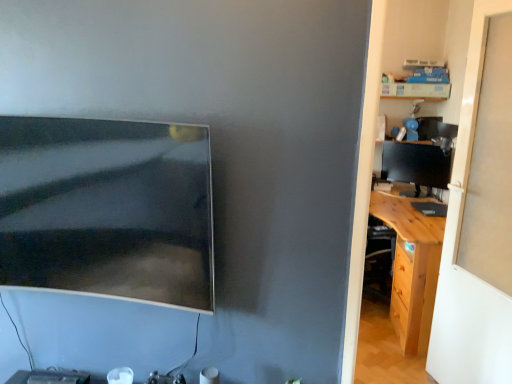
What do you see at coordinates (412, 267) in the screenshot? This screenshot has width=512, height=384. I see `light brown wood desk at right` at bounding box center [412, 267].

This screenshot has width=512, height=384. What do you see at coordinates (106, 209) in the screenshot?
I see `matte black monitor at upper left, the 2th computer monitor positioned from the back` at bounding box center [106, 209].

The width and height of the screenshot is (512, 384). Find the location of `matte black monitor at right, the 1th computer monitor positioned from the right`. matte black monitor at right, the 1th computer monitor positioned from the right is located at coordinates (416, 165).

Is point (418, 182) in front of point (396, 72)?

Yes, it is.

Would you consider matte black monitor at right, marked as the 2th computer monitor in a front-to-back arrangement, to be distant from wooden desk at right?

Actually, matte black monitor at right, marked as the 2th computer monitor in a front-to-back arrangement, and wooden desk at right are a little close together.

Is matte black monitor at right, the 1th computer monitor positioned from the right, behind wooden desk at right?

Yes, it is.

What's the angular difference between matte black monitor at right, placed as the second computer monitor when sorted from left to right, and wooden desk at right's facing directions?

39.1 degrees separate the facing orientations of matte black monitor at right, placed as the second computer monitor when sorted from left to right, and wooden desk at right.

Is wooden desk at right not inside matte black monitor at upper left, acting as the 1th computer monitor starting from the front?

Indeed, wooden desk at right is completely outside matte black monitor at upper left, acting as the 1th computer monitor starting from the front.

Consider the image. Is wooden desk at right oriented towards matte black monitor at upper left, acting as the 1th computer monitor starting from the front?

No, wooden desk at right is not aimed at matte black monitor at upper left, acting as the 1th computer monitor starting from the front.

Looking at this image, does wooden desk at right come in front of matte black monitor at upper left, the 2th computer monitor positioned from the back?

That is True.

Does point (355, 237) come closer to viewer compared to point (89, 253)?

That is True.

Looking at this image, is wooden desk at right located outside light brown wood desk at right?

wooden desk at right lies outside light brown wood desk at right's area.

From a real-world perspective, is wooden desk at right physically above light brown wood desk at right?

Yes, from a real-world perspective, wooden desk at right is on top of light brown wood desk at right.

Is wooden desk at right at the right side of light brown wood desk at right?

No, wooden desk at right is not to the right of light brown wood desk at right.

From the image's perspective, which one is positioned lower, wooden desk at right or light brown wood desk at right?

light brown wood desk at right, from the image's perspective.

Is matte black monitor at right, positioned as the first computer monitor in back-to-front order, inside the boundaries of light brown wood desk at right, or outside?

matte black monitor at right, positioned as the first computer monitor in back-to-front order, is not inside light brown wood desk at right, it's outside.

From a real-world perspective, is matte black monitor at right, placed as the second computer monitor when sorted from left to right, physically located above or below light brown wood desk at right?

Clearly, from a real-world perspective, matte black monitor at right, placed as the second computer monitor when sorted from left to right, is above light brown wood desk at right.

In order to click on desk that is on the left side of matte black monitor at right, positioned as the first computer monitor in back-to-front order in this screenshot , I will do `click(412, 267)`.

Find the location of a particular element. The image size is (512, 384). computer monitor on the right of matte black monitor at upper left, the 2th computer monitor from the right is located at coordinates (416, 165).

Looking at their sizes, would you say matte black monitor at right, positioned as the first computer monitor in back-to-front order, is wider or thinner than matte black monitor at upper left, the 2th computer monitor positioned from the back?

Clearly, matte black monitor at right, positioned as the first computer monitor in back-to-front order, has less width compared to matte black monitor at upper left, the 2th computer monitor positioned from the back.

From the image's perspective, which one is positioned higher, matte black monitor at right, marked as the 2th computer monitor in a front-to-back arrangement, or matte black monitor at upper left, acting as the 1th computer monitor starting from the front?

matte black monitor at right, marked as the 2th computer monitor in a front-to-back arrangement.

Is wooden desk at right touching matte black monitor at right, marked as the 2th computer monitor in a front-to-back arrangement?

wooden desk at right and matte black monitor at right, marked as the 2th computer monitor in a front-to-back arrangement, are not in contact.

Is wooden desk at right looking in the opposite direction of matte black monitor at right, positioned as the first computer monitor in back-to-front order?

Absolutely, wooden desk at right is directed away from matte black monitor at right, positioned as the first computer monitor in back-to-front order.

Would you say wooden desk at right is to the left or to the right of matte black monitor at right, marked as the 2th computer monitor in a front-to-back arrangement, in the picture?

wooden desk at right is to the left of matte black monitor at right, marked as the 2th computer monitor in a front-to-back arrangement.

From the image's perspective, is wooden desk at right located beneath matte black monitor at right, positioned as the first computer monitor in back-to-front order?

Yes, from the image's perspective, wooden desk at right is beneath matte black monitor at right, positioned as the first computer monitor in back-to-front order.

Based on their sizes in the image, would you say light brown wood desk at right is bigger or smaller than wooden desk at right?

Clearly, light brown wood desk at right is larger in size than wooden desk at right.

Based on the photo, is there a large distance between light brown wood desk at right and wooden desk at right?

That's right, there is a large distance between light brown wood desk at right and wooden desk at right.

From a real-world perspective, is light brown wood desk at right over wooden desk at right?

No.

Is light brown wood desk at right facing towards wooden desk at right?

No, light brown wood desk at right is not aimed at wooden desk at right.

I want to click on computer monitor on the right of wooden desk at right, so click(416, 165).

From the wooden desk at right, count 1st computer monitors backward and point to it. Please provide its 2D coordinates.

[(106, 209)]

When comparing their distances from matte black monitor at right, placed as the second computer monitor when sorted from left to right, does light brown wood desk at right or matte black monitor at upper left, the 2th computer monitor positioned from the back, seem further?

Among the two, matte black monitor at upper left, the 2th computer monitor positioned from the back, is located further to matte black monitor at right, placed as the second computer monitor when sorted from left to right.

From the image, which object appears to be nearer to light brown wood desk at right, matte black monitor at upper left, acting as the 1th computer monitor starting from the front, or matte black monitor at right, placed as the second computer monitor when sorted from left to right?

The object closer to light brown wood desk at right is matte black monitor at right, placed as the second computer monitor when sorted from left to right.

Based on their spatial positions, is wooden desk at right or light brown wood desk at right further from matte black monitor at right, placed as the second computer monitor when sorted from left to right?

Based on the image, light brown wood desk at right appears to be further to matte black monitor at right, placed as the second computer monitor when sorted from left to right.

Considering their positions, is matte black monitor at upper left, acting as the 1th computer monitor starting from the front, positioned closer to matte black monitor at right, the 1th computer monitor positioned from the right, than light brown wood desk at right?

light brown wood desk at right.

From the image, which object appears to be nearer to light brown wood desk at right, matte black monitor at right, marked as the 2th computer monitor in a front-to-back arrangement, or matte black monitor at upper left, the 2th computer monitor positioned from the back?

matte black monitor at right, marked as the 2th computer monitor in a front-to-back arrangement.

Consider the image. Which object lies nearer to the anchor point light brown wood desk at right, matte black monitor at upper left, acting as the 1th computer monitor starting from the front, or wooden desk at right?

Based on the image, wooden desk at right appears to be nearer to light brown wood desk at right.

From the image, which object appears to be farther from light brown wood desk at right, matte black monitor at right, positioned as the first computer monitor in back-to-front order, or wooden desk at right?

wooden desk at right lies further to light brown wood desk at right than the other object.

Which object lies nearer to the anchor point wooden desk at right, matte black monitor at right, marked as the 2th computer monitor in a front-to-back arrangement, or matte black monitor at upper left, the 2th computer monitor from the right?

Among the two, matte black monitor at right, marked as the 2th computer monitor in a front-to-back arrangement, is located nearer to wooden desk at right.

The height and width of the screenshot is (384, 512). What are the coordinates of `dresser between matte black monitor at upper left, the 2th computer monitor from the right, and light brown wood desk at right` in the screenshot? It's located at (428, 43).

Locate an element on the screen. desk between matte black monitor at upper left, positioned as the 1th computer monitor in left-to-right order, and matte black monitor at right, positioned as the first computer monitor in back-to-front order is located at coordinates (412, 267).

Image resolution: width=512 pixels, height=384 pixels. I want to click on desk between wooden desk at right and matte black monitor at right, marked as the 2th computer monitor in a front-to-back arrangement, in the front-back direction, so click(x=412, y=267).

This screenshot has height=384, width=512. Find the location of `computer monitor between wooden desk at right and matte black monitor at right, marked as the 2th computer monitor in a front-to-back arrangement, in the front-back direction`. computer monitor between wooden desk at right and matte black monitor at right, marked as the 2th computer monitor in a front-to-back arrangement, in the front-back direction is located at coordinates (106, 209).